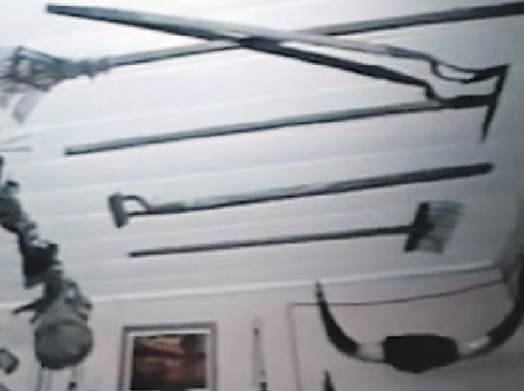
Where is `white wall`? The width and height of the screenshot is (524, 391). white wall is located at coordinates (227, 300).